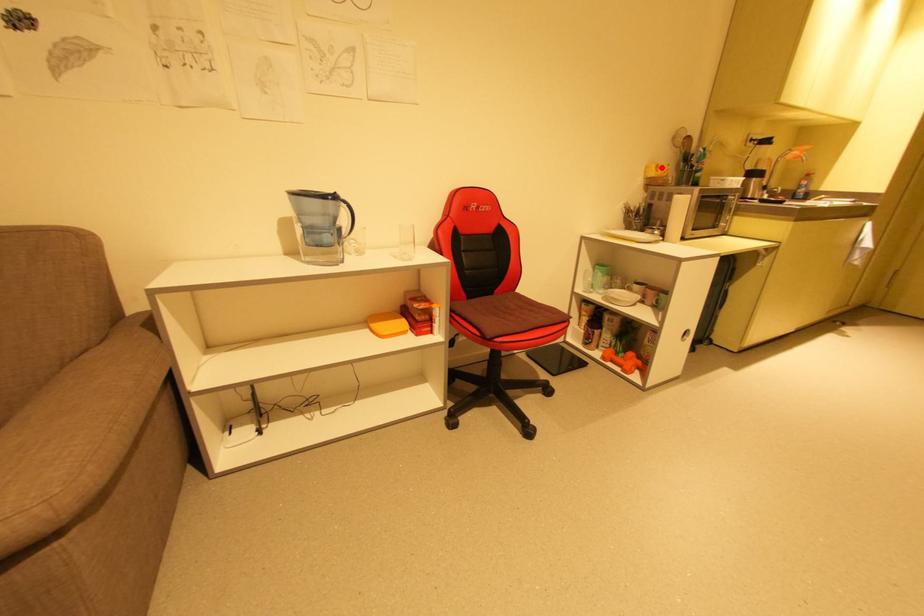
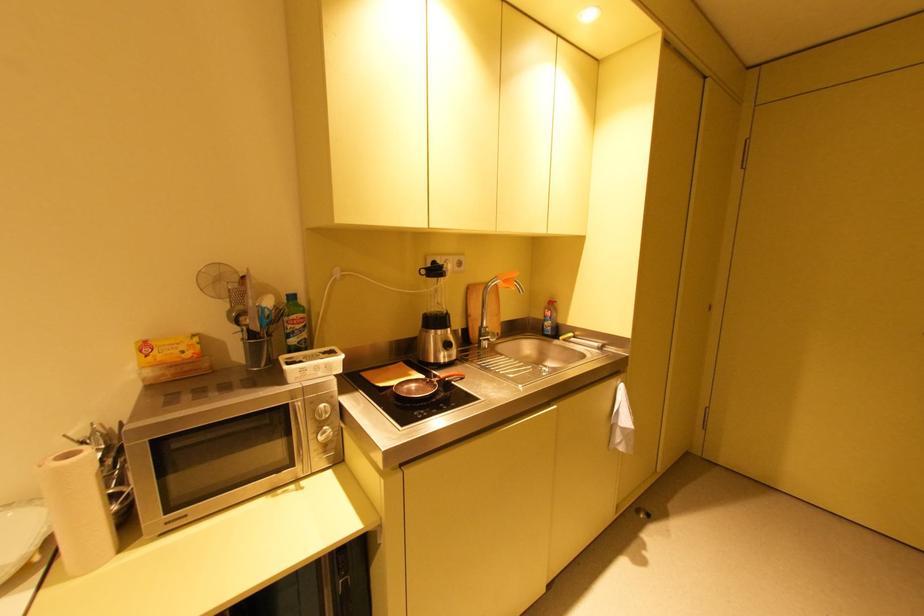
Where in the second image is the point corresponding to the highlighted location from the first image?

(150, 347)